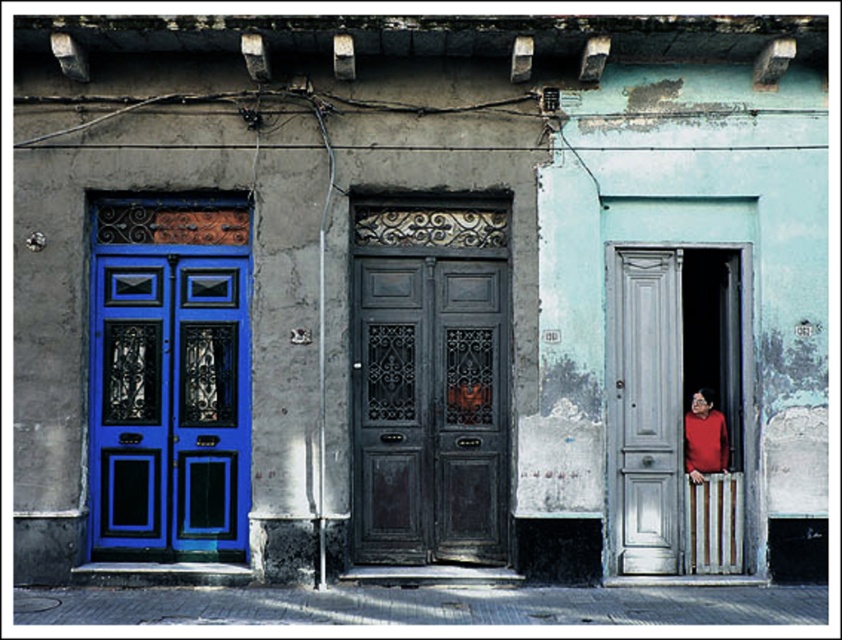
Question: Does dark wood/wooden door at center have a greater width compared to shiny blue door at left?

Choices:
 (A) yes
 (B) no

Answer: (B)

Question: Can you confirm if shiny blue door at left is positioned above matte red shirt at right?

Choices:
 (A) yes
 (B) no

Answer: (A)

Question: Estimate the real-world distances between objects in this image. Which object is closer to the matte red shirt at right?

Choices:
 (A) dark wood/wooden door at center
 (B) shiny blue door at left

Answer: (A)

Question: Among these objects, which one is nearest to the camera?

Choices:
 (A) matte red shirt at right
 (B) dark wood/wooden door at center
 (C) shiny blue door at left

Answer: (C)

Question: Can you confirm if shiny blue door at left is bigger than matte red shirt at right?

Choices:
 (A) yes
 (B) no

Answer: (A)

Question: Which object is closer to the camera taking this photo?

Choices:
 (A) shiny blue door at left
 (B) dark wood/wooden door at center

Answer: (A)